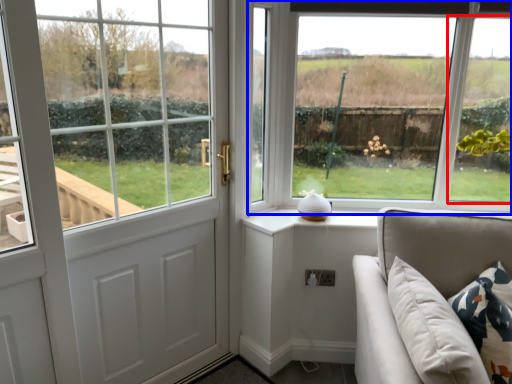
Question: Which of the following is the closest to the observer, window (highlighted by a red box) or window (highlighted by a blue box)?

Choices:
 (A) window
 (B) window

Answer: (A)